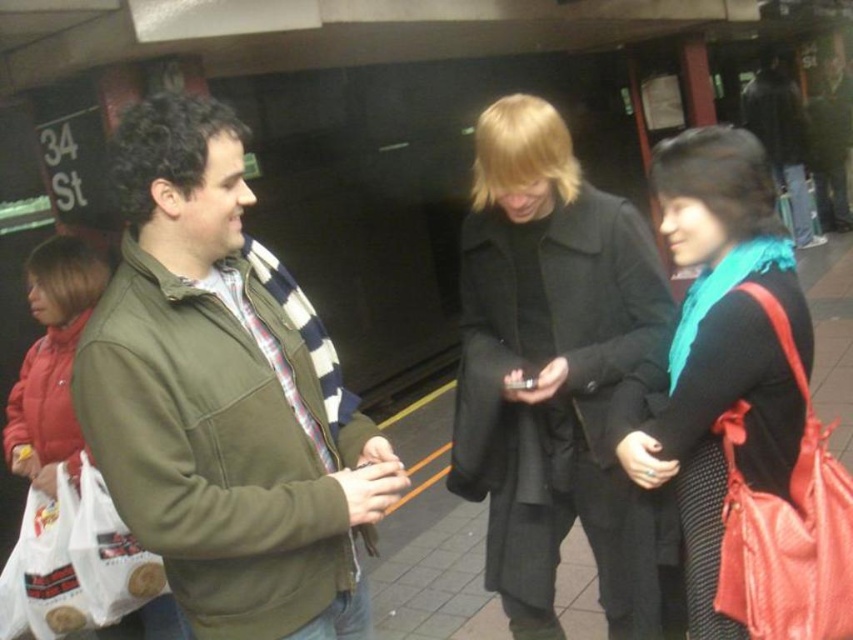
Can you confirm if matte green jacket at left is positioned below teal fabric scarf at center?

Actually, matte green jacket at left is above teal fabric scarf at center.

Is the position of matte green jacket at left less distant than that of teal fabric scarf at center?

That is True.

Locate an element on the screen. This screenshot has height=640, width=853. matte green jacket at left is located at coordinates (219, 401).

Where is `matte green jacket at left`? matte green jacket at left is located at coordinates (219, 401).

Does black wool coat at center have a larger size compared to teal fabric scarf at center?

Indeed, black wool coat at center has a larger size compared to teal fabric scarf at center.

Does black wool coat at center lie behind teal fabric scarf at center?

Yes.

Where is `black wool coat at center`? The height and width of the screenshot is (640, 853). black wool coat at center is located at coordinates (553, 371).

Can you confirm if matte green jacket at left is taller than black wool coat at center?

No.

Locate an element on the screen. matte green jacket at left is located at coordinates (219, 401).